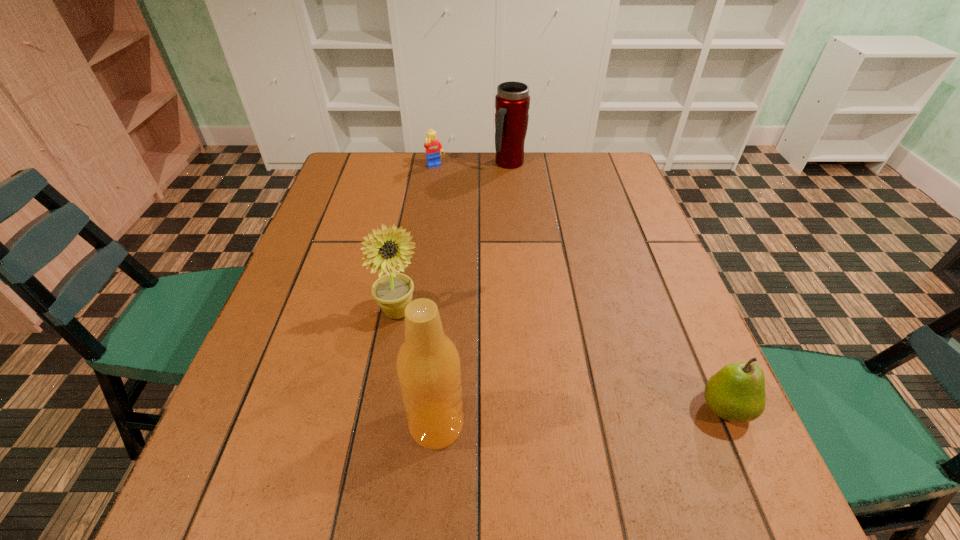
Where is `beer bottle`? beer bottle is located at coordinates (428, 366).

At what (x,y) coordinates should I click in order to perform the action: click on the rightmost object. Please return your answer as a coordinate pair (x, y). Looking at the image, I should click on (736, 392).

At what (x,y) coordinates should I click in order to perform the action: click on sunflower. Please return your answer as a coordinate pair (x, y). The width and height of the screenshot is (960, 540). Looking at the image, I should click on (393, 292).

Identify the location of Lego. The width and height of the screenshot is (960, 540). (433, 147).

Where is `thermos bottle`? This screenshot has height=540, width=960. thermos bottle is located at coordinates (512, 102).

Where is `free space located 0.320m on the left of the tallest object`? The width and height of the screenshot is (960, 540). free space located 0.320m on the left of the tallest object is located at coordinates (228, 425).

Locate an element on the screen. The image size is (960, 540). free space located 0.200m on the left of the rightmost object is located at coordinates (588, 408).

Image resolution: width=960 pixels, height=540 pixels. In order to click on vacant position located 0.380m on the face of the sunflower in this screenshot , I will do `click(588, 396)`.

Locate an element on the screen. blank area located 0.370m on the face of the sunflower is located at coordinates (584, 394).

Where is `vacant point located on the face of the sunflower`? Image resolution: width=960 pixels, height=540 pixels. vacant point located on the face of the sunflower is located at coordinates (498, 355).